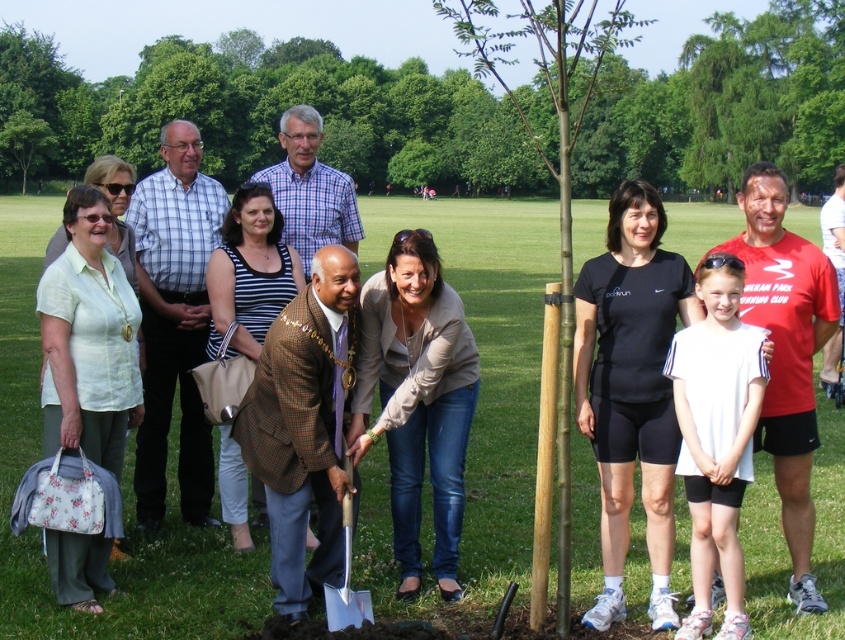
Question: Is green smooth bark tree at center positioned at the back of green leafy tree at upper left?

Choices:
 (A) no
 (B) yes

Answer: (A)

Question: Is green smooth bark tree at center wider than beige textured blazer at center?

Choices:
 (A) yes
 (B) no

Answer: (A)

Question: Among these objects, which one is farthest from the camera?

Choices:
 (A) green smooth bark tree at center
 (B) white cotton shirt at center

Answer: (A)

Question: Which of the following is the farthest from the observer?

Choices:
 (A) (747, 88)
 (B) (706, 294)
 (C) (544, 244)
 (D) (459, 444)

Answer: (A)

Question: Which of the following is the farthest from the observer?

Choices:
 (A) silver metallic shovel at center
 (B) green bamboo at center
 (C) green smooth bark tree at center

Answer: (C)

Question: Considering the relative positions of green smooth bark tree at center and beige textured blazer at center in the image provided, where is green smooth bark tree at center located with respect to beige textured blazer at center?

Choices:
 (A) right
 (B) left

Answer: (B)